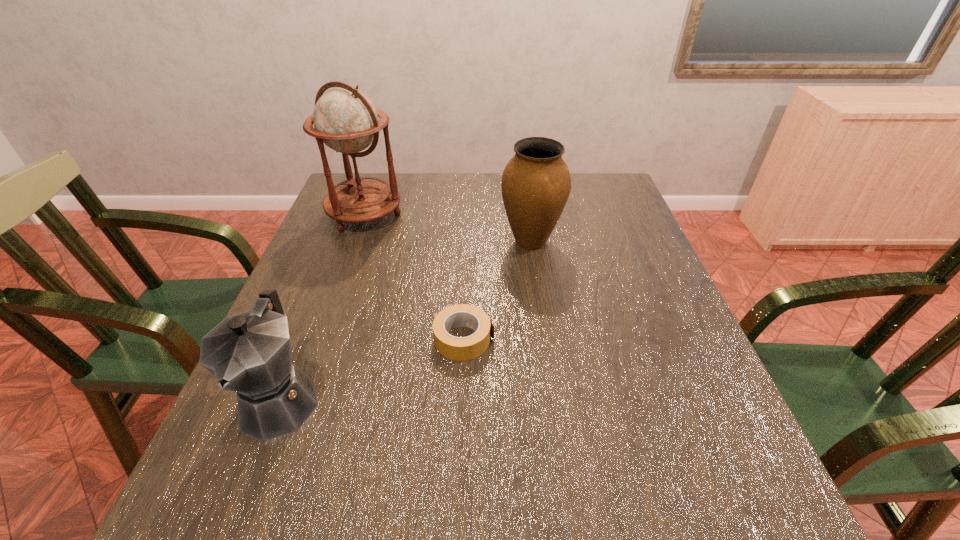
Image resolution: width=960 pixels, height=540 pixels. What are the coordinates of `object that ranks as the second closest to the third object from left to right` in the screenshot? It's located at (536, 183).

Identify which object is located as the second nearest to the coffeepot. Please provide its 2D coordinates. Your answer should be formatted as a tuple, i.e. [(x, y)], where the tuple contains the x and y coordinates of a point satisfying the conditions above.

[(345, 120)]

The image size is (960, 540). In order to click on free space in the image that satisfies the following two spatial constraints: 1. on the front side of the rightmost object; 2. at the edge of the duct tape in this screenshot , I will do `click(544, 339)`.

Where is `free space that satisfies the following two spatial constraints: 1. at the edge of the shortest object; 2. at the spout of the coffeepot`? Image resolution: width=960 pixels, height=540 pixels. free space that satisfies the following two spatial constraints: 1. at the edge of the shortest object; 2. at the spout of the coffeepot is located at coordinates (462, 400).

Where is `vacant space that satisfies the following two spatial constraints: 1. at the edge of the shortest object; 2. at the spout of the third tallest object`? Image resolution: width=960 pixels, height=540 pixels. vacant space that satisfies the following two spatial constraints: 1. at the edge of the shortest object; 2. at the spout of the third tallest object is located at coordinates (462, 400).

Find the location of a particular element. The width and height of the screenshot is (960, 540). free region that satisfies the following two spatial constraints: 1. on the surface of the second tallest object; 2. on the left side of the globe is located at coordinates (355, 241).

Find the location of a particular element. blank area in the image that satisfies the following two spatial constraints: 1. on the front side of the second tallest object; 2. at the edge of the shortest object is located at coordinates click(x=544, y=339).

Identify the location of vacant point that satisfies the following two spatial constraints: 1. at the edge of the second object from right to left; 2. at the spout of the third tallest object. (462, 400).